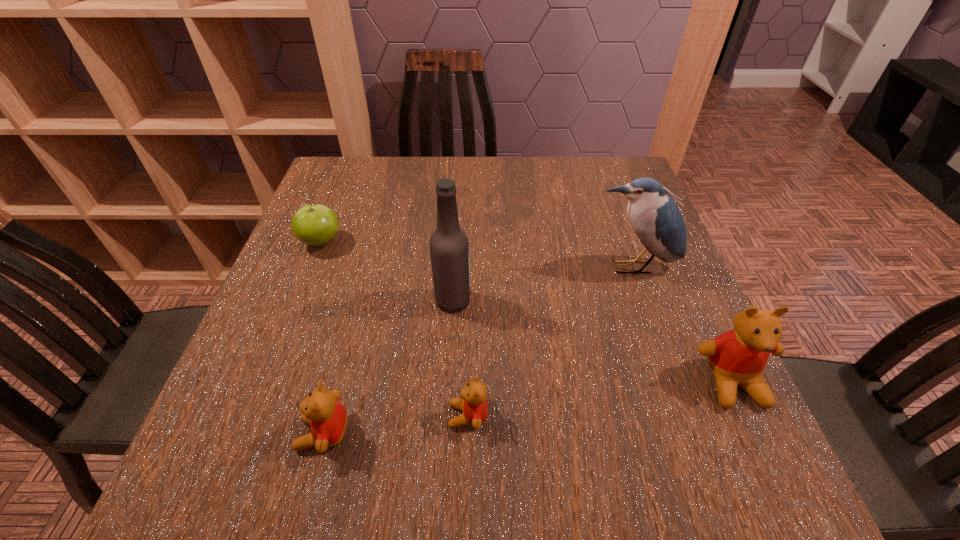
To make them evenly spaced by inserting another teddy_bear among them, please locate a vacant spot for this new teddy_bear. Please provide its 2D coordinates. Your answer should be formatted as a tuple, i.e. [(x, y)], where the tuple contains the x and y coordinates of a point satisfying the conditions above.

[(604, 399)]